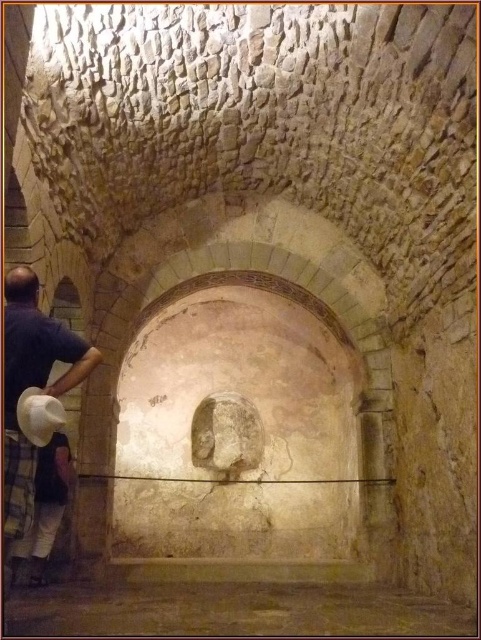
Is white fabric hat at left above white felt cowboy hat at lower left?

No, white fabric hat at left is not above white felt cowboy hat at lower left.

Is point (12, 275) positioned after point (32, 435)?

Yes, it is.

Find the location of a particular element. This screenshot has height=640, width=481. white fabric hat at left is located at coordinates (29, 387).

Is point (138, 586) positioned in front of point (9, 333)?

No, it is not.

Does smooth stone wall at center appear on the left side of white fabric hat at left?

No, smooth stone wall at center is not to the left of white fabric hat at left.

Locate an element on the screen. This screenshot has height=640, width=481. smooth stone wall at center is located at coordinates (229, 609).

Can you confirm if smooth stone wall at center is taller than white felt cowboy hat at lower left?

Correct, smooth stone wall at center is much taller as white felt cowboy hat at lower left.

Who is positioned more to the left, smooth stone wall at center or white felt cowboy hat at lower left?

Positioned to the left is white felt cowboy hat at lower left.

Which is in front, point (422, 618) or point (48, 426)?

Positioned in front is point (48, 426).

At what (x,y) coordinates should I click in order to perform the action: click on smooth stone wall at center. Please return your answer as a coordinate pair (x, y). Looking at the image, I should click on (229, 609).